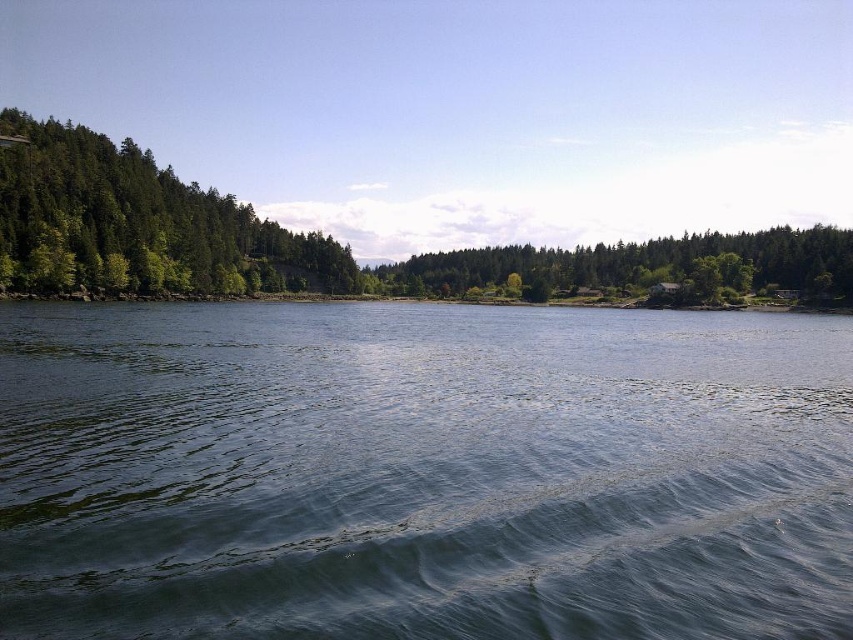
You are planning to build a small dock for fishing. The dock needs to be placed between the clear water at center and the green matte tree at center. If the dock is 200 feet long, will it fit between them?

The distance between the clear water at center and the green matte tree at center is 509.65 feet. Since the dock is only 200 feet long, it will easily fit between them with plenty of space remaining.

You are standing at the edge of the clear water at center and want to walk to the green matte trees at left. Which direction should you go?

You should walk to the left because the green matte trees at left are located to the left side of the clear water at center.

You are standing at the water edge and want to walk to the green matte tree at center. There is a green matte trees at left blocking your path. Can you walk around it? Explain why.

The green matte trees at left is 84.19 meters away from the green matte tree at center. Since the distance between them is significant, you can easily walk around the green matte trees at left to reach the green matte tree at center.